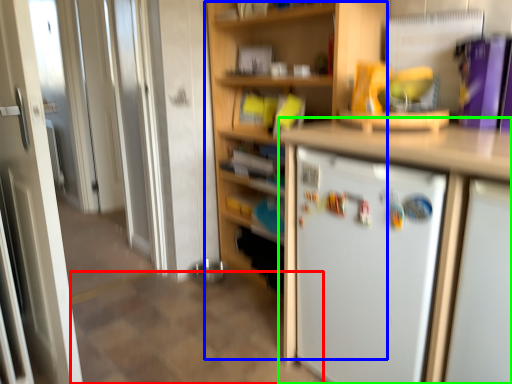
Question: Estimate the real-world distances between objects in this image. Which object is closer to tile (highlighted by a red box), bookshelf (highlighted by a blue box) or cabinetry (highlighted by a green box)?

Choices:
 (A) bookshelf
 (B) cabinetry

Answer: (B)